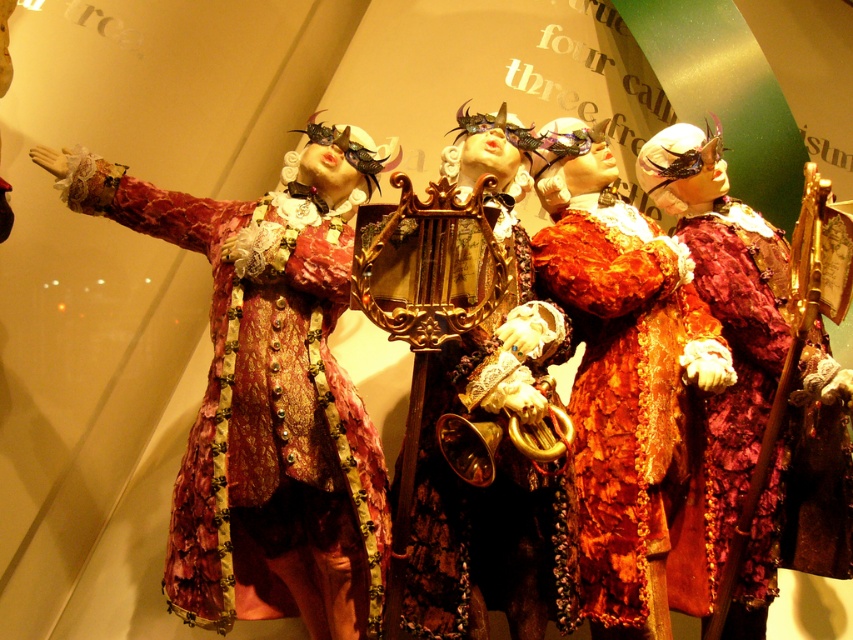
Question: Which point is closer to the camera?

Choices:
 (A) (457, 580)
 (B) (770, 276)

Answer: (A)

Question: Which object appears farthest from the camera in this image?

Choices:
 (A) gold metallic lyre at center
 (B) velvet maroon dress at center

Answer: (B)

Question: Is velvet brocade coat at center below velvet maroon dress at center?

Choices:
 (A) yes
 (B) no

Answer: (B)

Question: Is velvet brocade coat at center bigger than floral velvet robe at center?

Choices:
 (A) yes
 (B) no

Answer: (A)

Question: Which object appears closest to the camera in this image?

Choices:
 (A) floral velvet robe at center
 (B) velvet maroon dress at center

Answer: (A)

Question: Is velvet maroon dress at center further to camera compared to gold metallic lyre at center?

Choices:
 (A) no
 (B) yes

Answer: (B)